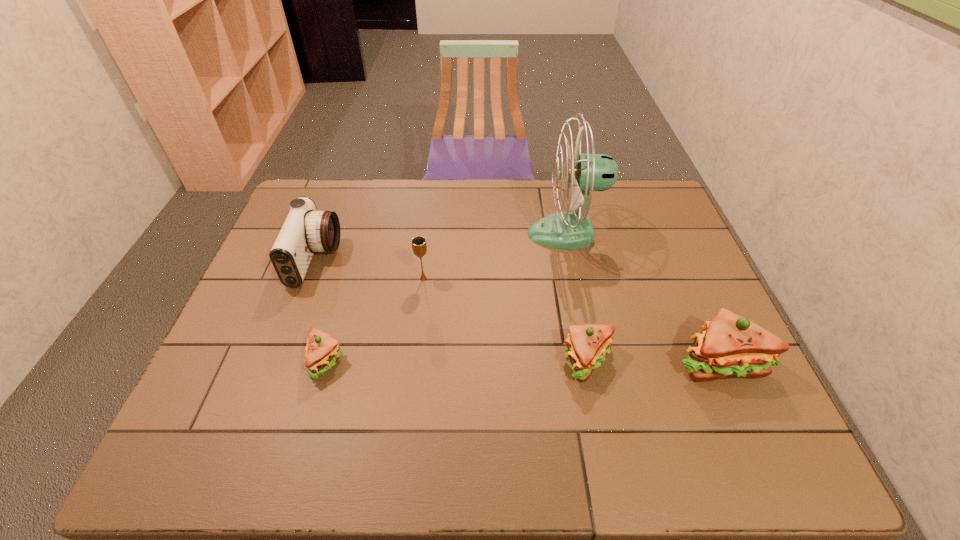
Locate an element on the screen. free spot between the shortest object and the rightmost sandwich is located at coordinates (522, 361).

The image size is (960, 540). I want to click on vacant region between the shortest sandwich and the leftmost object, so click(321, 310).

Locate an element on the screen. This screenshot has width=960, height=540. free space between the fan and the tallest sandwich is located at coordinates (642, 298).

This screenshot has height=540, width=960. Identify the location of unoccupied position between the rightmost object and the camcorder. (517, 311).

This screenshot has height=540, width=960. I want to click on vacant space that is in between the tallest object and the second sandwich from left to right, so click(577, 298).

Find the location of `vacant area that lies between the shortest object and the tallest sandwich`. vacant area that lies between the shortest object and the tallest sandwich is located at coordinates pos(522,361).

The image size is (960, 540). I want to click on unoccupied area between the third object from left to right and the camcorder, so click(370, 269).

This screenshot has width=960, height=540. Identify the location of object that is the fifth closest to the fourth object from right to left. (730, 346).

Identify which object is located as the nearest to the rightmost sandwich. Please provide its 2D coordinates. Your answer should be formatted as a tuple, i.e. [(x, y)], where the tuple contains the x and y coordinates of a point satisfying the conditions above.

[(587, 345)]

Choose which sandwich is the third nearest neighbor to the leftmost object. Please provide its 2D coordinates. Your answer should be formatted as a tuple, i.e. [(x, y)], where the tuple contains the x and y coordinates of a point satisfying the conditions above.

[(730, 346)]